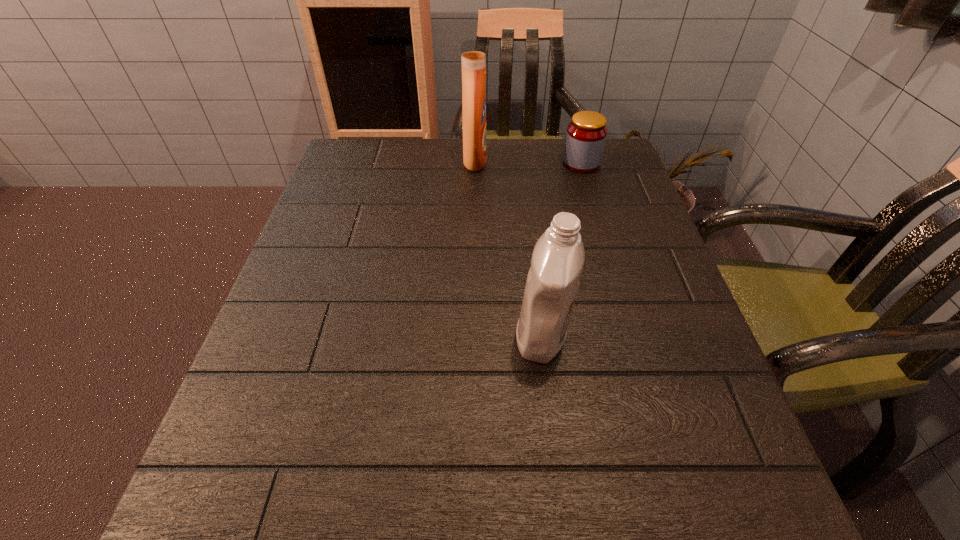
Where is `the left detergent`? Image resolution: width=960 pixels, height=540 pixels. the left detergent is located at coordinates (473, 52).

Identify the location of the farther detergent. Image resolution: width=960 pixels, height=540 pixels. (473, 52).

This screenshot has width=960, height=540. What are the coordinates of `the nearer detergent` in the screenshot? It's located at (557, 261).

The height and width of the screenshot is (540, 960). Find the location of `the nearest object`. the nearest object is located at coordinates (557, 261).

The width and height of the screenshot is (960, 540). In order to click on the rightmost object in this screenshot , I will do [586, 134].

At what (x,y) coordinates should I click in order to perform the action: click on the shortest object. Please return your answer as a coordinate pair (x, y). Looking at the image, I should click on (586, 134).

This screenshot has width=960, height=540. I want to click on vacant region located 0.070m on the front-facing side of the leftmost object, so click(x=513, y=161).

Where is `free spot located on the back of the second object from left to right`? The height and width of the screenshot is (540, 960). free spot located on the back of the second object from left to right is located at coordinates (525, 204).

Where is `free location located 0.360m on the left of the shortest object`? free location located 0.360m on the left of the shortest object is located at coordinates (425, 164).

Identify the location of detergent that is at the far edge. (473, 52).